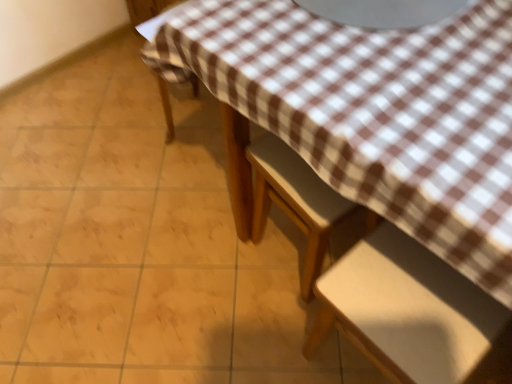
Where is `vacant space situated on the left part of brown checkered fabric at lower left, which is the first chair in top-to-bottom order`? This screenshot has width=512, height=384. vacant space situated on the left part of brown checkered fabric at lower left, which is the first chair in top-to-bottom order is located at coordinates (136, 131).